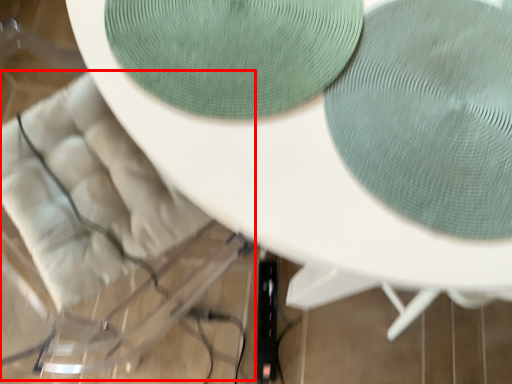
Question: From the image's perspective, considering the relative positions of swivel chair (annotated by the red box) and oval in the image provided, where is swivel chair (annotated by the red box) located with respect to the staircase?

Choices:
 (A) below
 (B) above

Answer: (A)